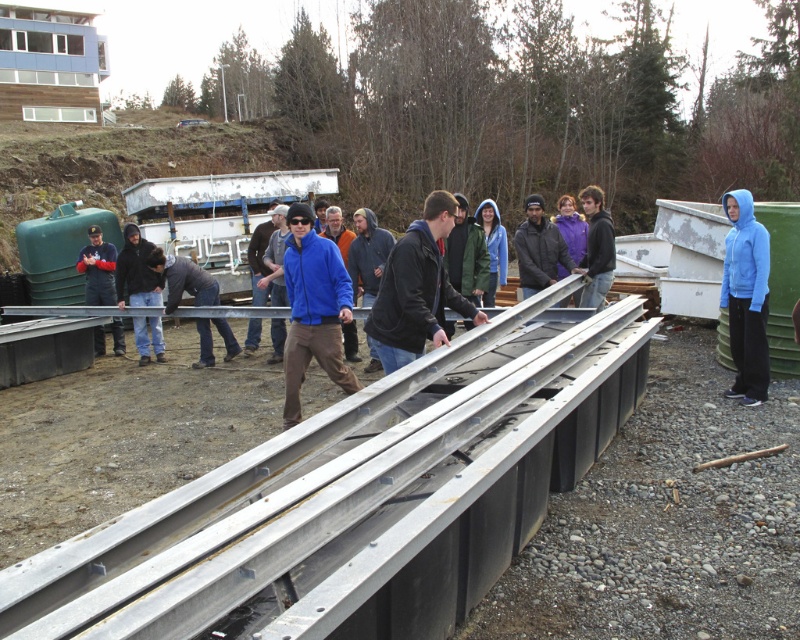
Is silver metallic rail at center thinner than blue fleece jacket at right?

In fact, silver metallic rail at center might be wider than blue fleece jacket at right.

Can you confirm if silver metallic rail at center is positioned below blue fleece jacket at right?

Correct, silver metallic rail at center is located below blue fleece jacket at right.

Does point (398, 508) come in front of point (758, 339)?

Yes, point (398, 508) is in front of point (758, 339).

The width and height of the screenshot is (800, 640). In order to click on silver metallic rail at center in this screenshot , I will do `click(356, 497)`.

Which is more to the right, silver metallic rail at center or blue fleece jacket at center?

Positioned to the right is silver metallic rail at center.

Does silver metallic rail at center appear under blue fleece jacket at center?

Indeed, silver metallic rail at center is positioned under blue fleece jacket at center.

What do you see at coordinates (356, 497) in the screenshot? I see `silver metallic rail at center` at bounding box center [356, 497].

You are a GUI agent. You are given a task and a screenshot of the screen. Output one action in this format:
    pyautogui.click(x=<x>, y=<y>)
    Task: Click on the silver metallic rail at center
    
    Given the screenshot: What is the action you would take?
    pyautogui.click(x=356, y=497)

Between blue fleece jacket at center and blue fleece jacket at right, which one appears on the left side from the viewer's perspective?

blue fleece jacket at center

Is blue fleece jacket at center taller than blue fleece jacket at right?

No.

Describe the element at coordinates (314, 308) in the screenshot. The height and width of the screenshot is (640, 800). I see `blue fleece jacket at center` at that location.

This screenshot has width=800, height=640. Find the location of `blue fleece jacket at center`. blue fleece jacket at center is located at coordinates (314, 308).